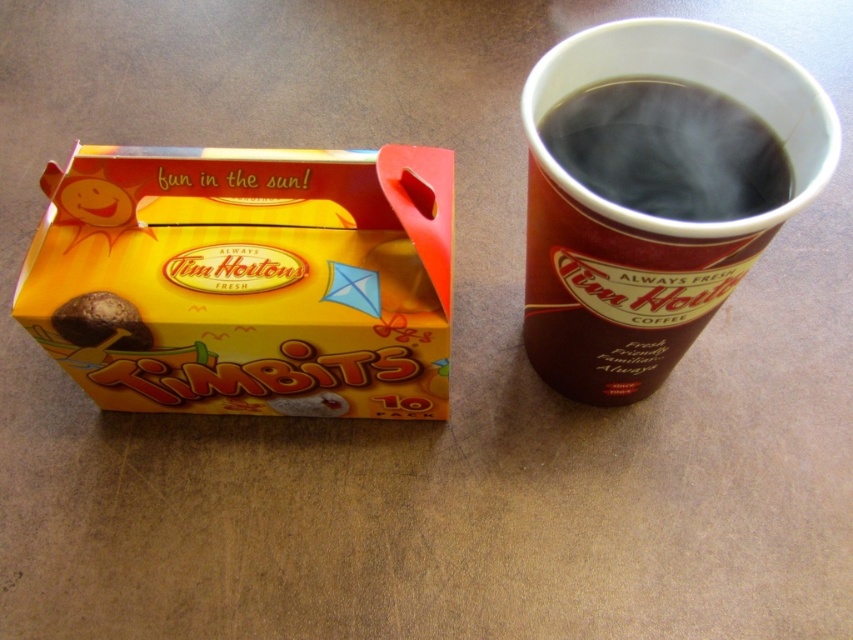
Question: Which point appears farthest from the camera in this image?

Choices:
 (A) (643, 260)
 (B) (99, 323)
 (C) (196, 253)

Answer: (C)

Question: Does black glossy cup at upper right have a smaller size compared to chocolate-coated donut at center-left?

Choices:
 (A) yes
 (B) no

Answer: (B)

Question: Which point is closer to the camera?

Choices:
 (A) black paper cup at right
 (B) chocolate-coated donut at center-left
 (C) yellow cardboard box at upper left

Answer: (A)

Question: Does black glossy cup at upper right appear over chocolate-coated donut at center-left?

Choices:
 (A) no
 (B) yes

Answer: (B)

Question: Is yellow cardboard box at upper left above black glossy cup at upper right?

Choices:
 (A) no
 (B) yes

Answer: (A)

Question: Which object is positioned closest to the black glossy cup at upper right?

Choices:
 (A) yellow cardboard box at upper left
 (B) chocolate-coated donut at center-left

Answer: (A)